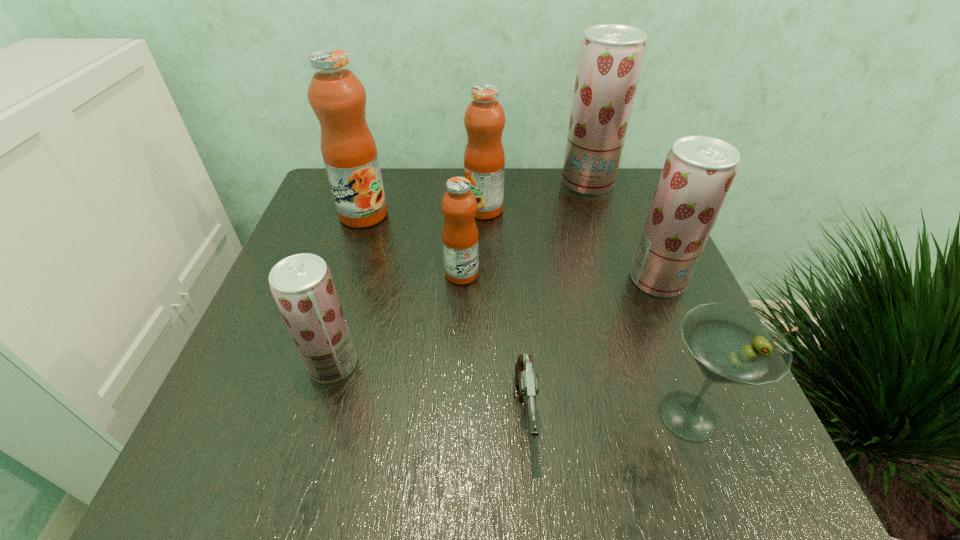
Identify the location of unoccupied position between the second biggest orange fruit juice and the farthest fruit juice. This screenshot has width=960, height=540. (536, 196).

Locate an element on the screen. This screenshot has width=960, height=540. vacant area between the second nearest strawberry fruit juice and the second smallest orange fruit juice is located at coordinates (570, 245).

Locate an element on the screen. This screenshot has width=960, height=540. object identified as the fifth closest to the second nearest strawberry fruit juice is located at coordinates (459, 205).

Find the location of a particular element. object that is the seventh closest to the farthest strawberry fruit juice is located at coordinates (302, 285).

Locate an element on the screen. This screenshot has width=960, height=540. fruit juice that can be found as the closest to the martini is located at coordinates (698, 172).

Locate which fruit juice ranks sixth in proximity to the fifth object from left to right. Please provide its 2D coordinates. Your answer should be formatted as a tuple, i.e. [(x, y)], where the tuple contains the x and y coordinates of a point satisfying the conditions above.

[(611, 56)]

Identify which strawberry fruit juice is the nearest to the second smallest strawberry fruit juice. Please provide its 2D coordinates. Your answer should be formatted as a tuple, i.e. [(x, y)], where the tuple contains the x and y coordinates of a point satisfying the conditions above.

[(611, 56)]

The width and height of the screenshot is (960, 540). Find the location of `strawberry fruit juice that is the closest one to the pistol`. strawberry fruit juice that is the closest one to the pistol is located at coordinates (302, 285).

Identify which orange fruit juice is located as the third nearest to the martini. Please provide its 2D coordinates. Your answer should be formatted as a tuple, i.e. [(x, y)], where the tuple contains the x and y coordinates of a point satisfying the conditions above.

[(336, 95)]

At what (x,y) coordinates should I click in order to perform the action: click on orange fruit juice that is the closest to the leftmost strawberry fruit juice. Please return your answer as a coordinate pair (x, y). Looking at the image, I should click on (459, 205).